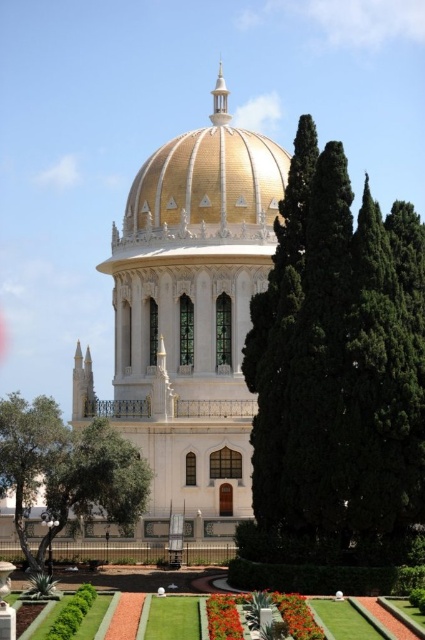
Can you confirm if smooth red flower at lower center is positioned to the left of smooth red flower at center?

No, smooth red flower at lower center is not to the left of smooth red flower at center.

Find the location of `smooth red flower at lower center`. smooth red flower at lower center is located at coordinates [224, 616].

You are a GUI agent. You are given a task and a screenshot of the screen. Output one action in this format:
    pyautogui.click(x=<x>, y=<y>)
    Task: Click on the smooth red flower at lower center
    
    Given the screenshot: What is the action you would take?
    pyautogui.click(x=224, y=616)

Is point (229, 596) farther from viewer compared to point (223, 624)?

Yes, it is behind point (223, 624).

Is green grass at lower center taller than smooth red flower at center?

Yes, green grass at lower center is taller than smooth red flower at center.

The image size is (425, 640). Describe the element at coordinates (388, 618) in the screenshot. I see `green grass at lower center` at that location.

At what (x,y) coordinates should I click in order to perform the action: click on green grass at lower center. Please return your answer as a coordinate pair (x, y). Looking at the image, I should click on (388, 618).

What do you see at coordinates (189, 317) in the screenshot? Image resolution: width=425 pixels, height=640 pixels. I see `white marble palace at center` at bounding box center [189, 317].

Image resolution: width=425 pixels, height=640 pixels. What are the coordinates of `white marble palace at center` in the screenshot? It's located at (189, 317).

Image resolution: width=425 pixels, height=640 pixels. I want to click on white marble palace at center, so click(x=189, y=317).